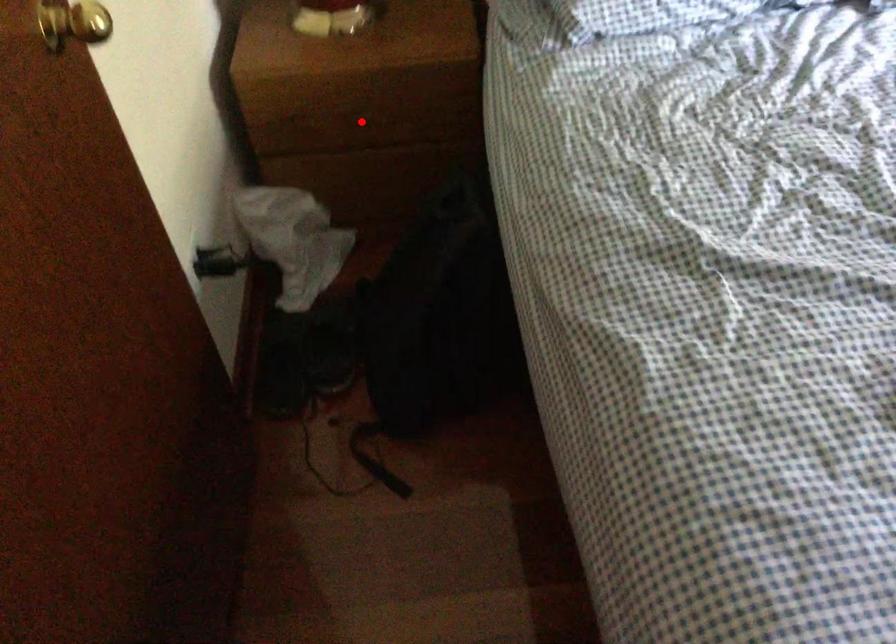
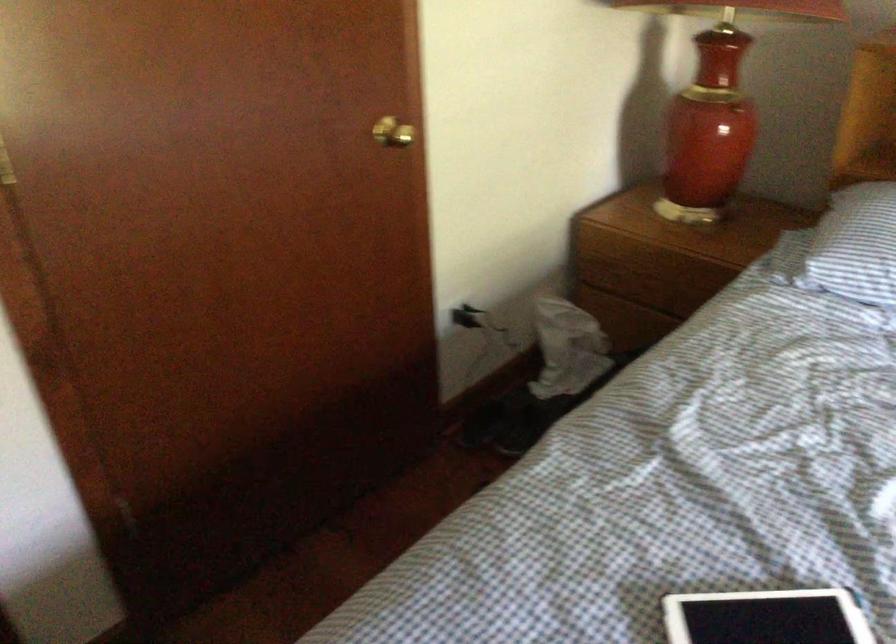
Question: A red point is marked in image1. In image2, is the corresponding 3D point closer to the camera or farther? Reply with the corresponding letter.

Choices:
 (A) The corresponding 3D point is closer.
 (B) The corresponding 3D point is farther.

Answer: (B)